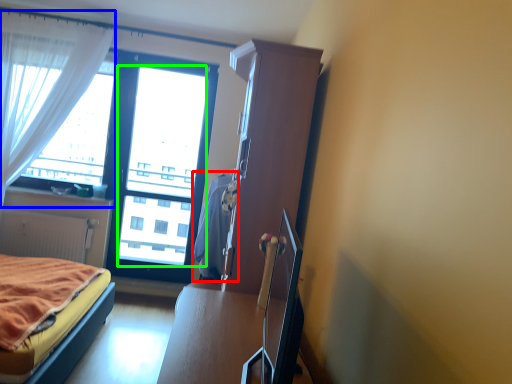
Question: Considering the real-world distances, which object is farthest from blanket (highlighted by a red box)? curtain (highlighted by a blue box) or window screen (highlighted by a green box)?

Choices:
 (A) curtain
 (B) window screen

Answer: (A)